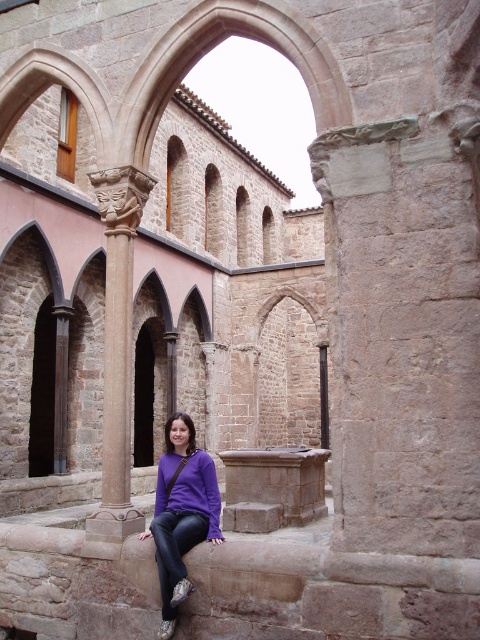
Question: Can you confirm if brown stone column at left is positioned to the left of purple matte sweatshirt at lower center?

Choices:
 (A) no
 (B) yes

Answer: (B)

Question: Which point is farther from the camera taking this photo?

Choices:
 (A) (188, 474)
 (B) (201, 461)
 (C) (105, 541)

Answer: (B)

Question: Is purple matte sweater at center closer to the viewer compared to purple matte sweatshirt at lower center?

Choices:
 (A) no
 (B) yes

Answer: (B)

Question: Estimate the real-world distances between objects in this image. Which object is closer to the brown stone column at left?

Choices:
 (A) purple matte sweater at center
 (B) purple matte sweatshirt at lower center

Answer: (A)

Question: Where is brown stone column at left located in relation to purple matte sweatshirt at lower center in the image?

Choices:
 (A) right
 (B) left

Answer: (B)

Question: Which of the following is the closest to the observer?

Choices:
 (A) purple matte sweater at center
 (B) purple matte sweatshirt at lower center

Answer: (A)